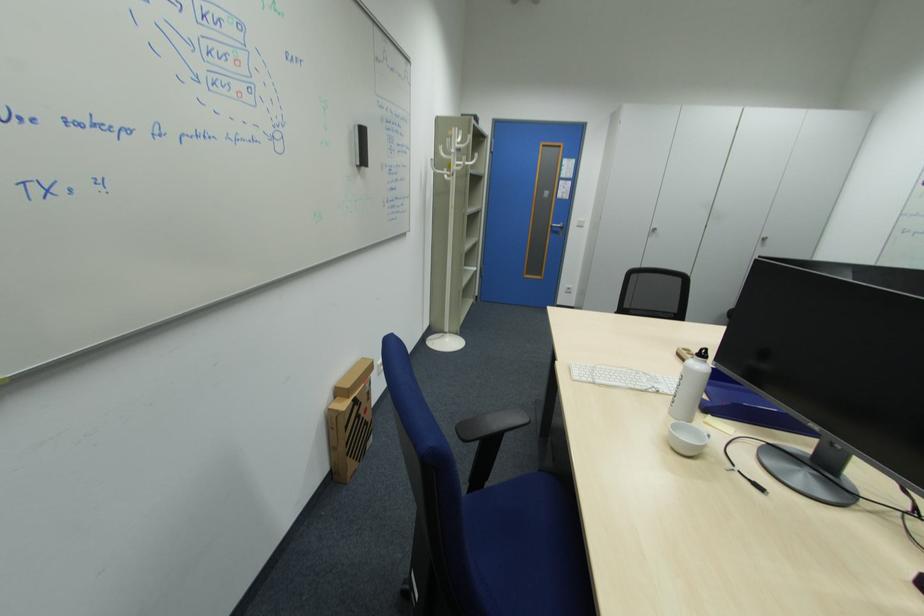
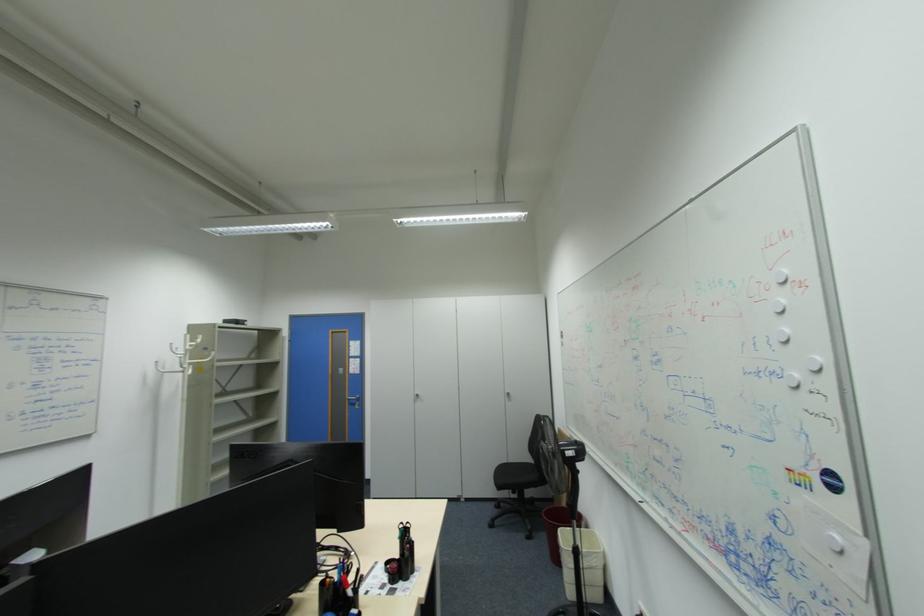
Question: What movement of the cameraman would produce the second image?

Choices:
 (A) Left
 (B) Right
 (C) Forward
 (D) Backward

Answer: (B)